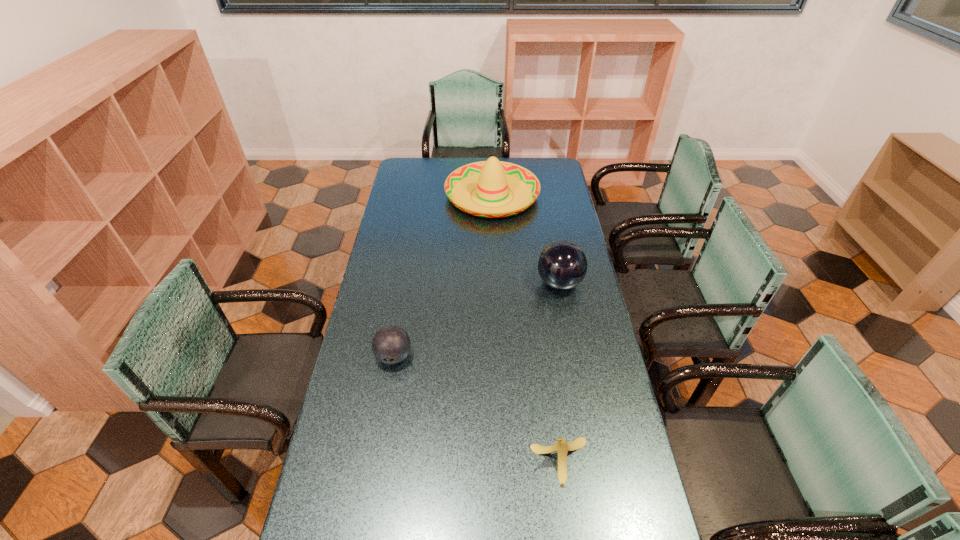
The width and height of the screenshot is (960, 540). In order to click on vacant space at the far right corner in this screenshot , I will do `click(543, 162)`.

Image resolution: width=960 pixels, height=540 pixels. What are the coordinates of `free spot between the banana and the farthest object` in the screenshot? It's located at (526, 328).

The height and width of the screenshot is (540, 960). What are the coordinates of `vacant area that lies between the farthest object and the leftmost object` in the screenshot? It's located at (443, 276).

Where is `free spot between the sombrero and the nearer bowling ball`? This screenshot has width=960, height=540. free spot between the sombrero and the nearer bowling ball is located at coordinates (443, 276).

At what (x,y) coordinates should I click in order to perform the action: click on free space between the farthest object and the nearest object. Please return your answer as a coordinate pair (x, y). Looking at the image, I should click on (526, 328).

Locate an element on the screen. The height and width of the screenshot is (540, 960). empty space that is in between the taller bowling ball and the second nearest object is located at coordinates (477, 320).

Find the location of `free space between the farther bowling ball and the nearer bowling ball`. free space between the farther bowling ball and the nearer bowling ball is located at coordinates (477, 320).

I want to click on object that stands as the second closest to the third farthest object, so click(x=562, y=265).

This screenshot has width=960, height=540. Find the location of `object that is the second nearest to the taller bowling ball`. object that is the second nearest to the taller bowling ball is located at coordinates (391, 344).